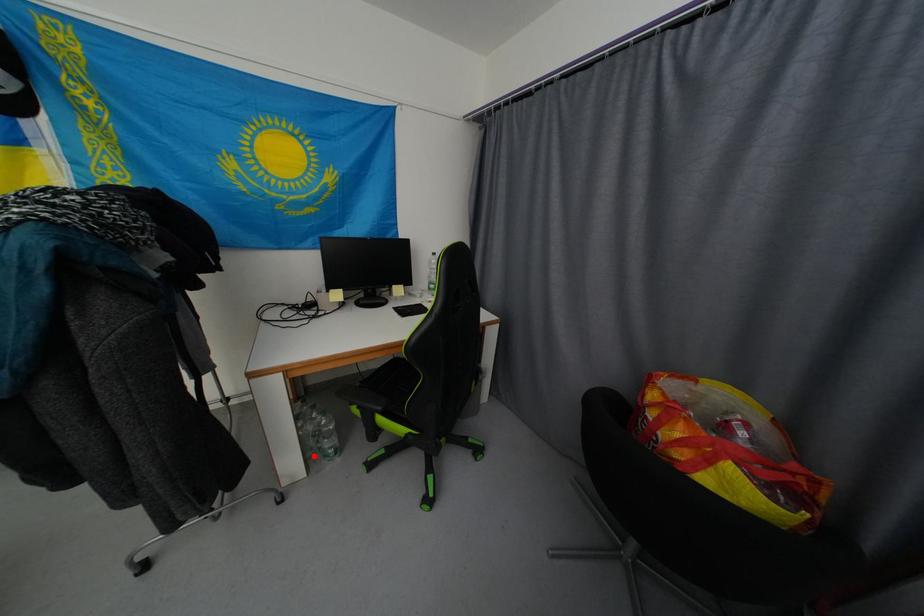
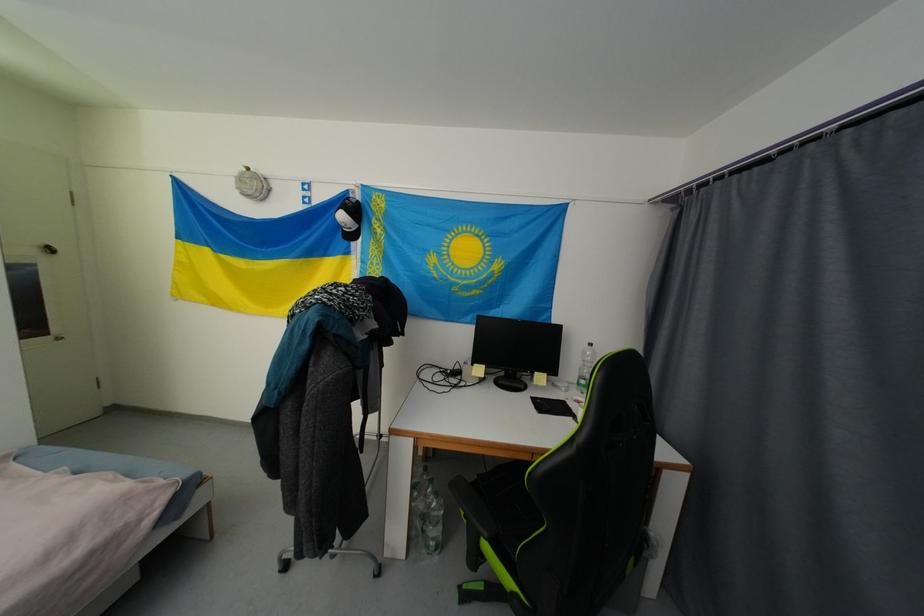
Question: I am providing you with two images of the same scene from different viewpoints. In image1, a red point is highlighted. Considering the same 3D point in image2, which of the following is correct?

Choices:
 (A) It is closer
 (B) It is farther

Answer: (B)